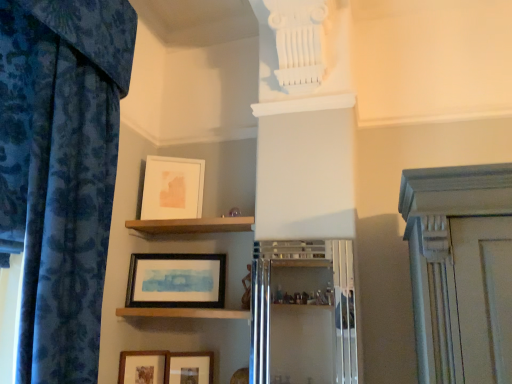
Question: Is wooden shelf at center, arranged as the 2th shelf when viewed from the top, in front of or behind black matte picture frame at lower center, the 3th picture frame ordered from the bottom, in the image?

Choices:
 (A) front
 (B) behind

Answer: (A)

Question: From a real-world perspective, is wooden shelf at center, arranged as the 2th shelf when viewed from the top, positioned above or below black matte picture frame at lower center, which is counted as the 2th picture frame, starting from the top?

Choices:
 (A) above
 (B) below

Answer: (B)

Question: Based on their relative distances, which object is farther from the black matte picture frame at lower center, which is counted as the 2th picture frame, starting from the top?

Choices:
 (A) wooden framed picture at lower center, positioned as the 3th picture frame in top-to-bottom order
 (B) brown wooden shelf at upper center, which is counted as the 2th shelf, starting from the bottom
 (C) wooden shelf at center, marked as the 1th shelf in a bottom-to-top arrangement
 (D) wooden matte picture frame at lower left, the first picture frame when ordered from bottom to top
 (E) metallic silver cabinet at center

Answer: (E)

Question: Estimate the real-world distances between objects in this image. Which object is farther from the metallic silver cabinet at center?

Choices:
 (A) brown wooden shelf at upper center, which is counted as the 2th shelf, starting from the bottom
 (B) blue floral fabric curtain at left
 (C) wooden matte picture frame at lower left, the 4th picture frame when ordered from top to bottom
 (D) black matte picture frame at lower center, which is counted as the 2th picture frame, starting from the top
 (E) wooden shelf at center, marked as the 1th shelf in a bottom-to-top arrangement

Answer: (B)